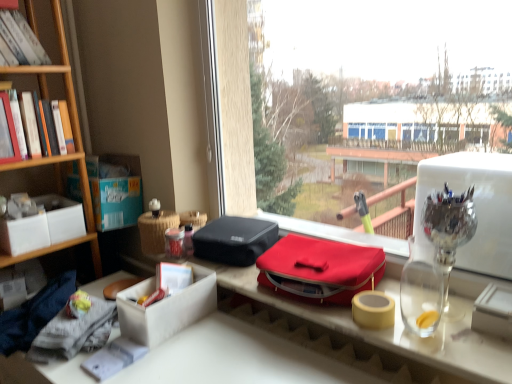
Question: From the image's perspective, is white cardboard box at center positioned above or below white matte box at left?

Choices:
 (A) below
 (B) above

Answer: (A)

Question: Is white cardboard box at center bigger or smaller than white matte box at left?

Choices:
 (A) big
 (B) small

Answer: (B)

Question: Estimate the real-world distances between objects in this image. Which object is farther from the yellow matte adhesive tape at right?

Choices:
 (A) matte red lunch box at center
 (B) white cardboard box at center
 (C) cardboard box at left
 (D) white matte box at left
 (E) transparent glass pen holder at upper right

Answer: (D)

Question: Considering the real-world distances, which object is closest to the yellow matte adhesive tape at right?

Choices:
 (A) white cardboard box at center
 (B) cardboard box at left
 (C) matte red lunch box at center
 (D) white matte box at left
 (E) transparent glass window at center

Answer: (A)